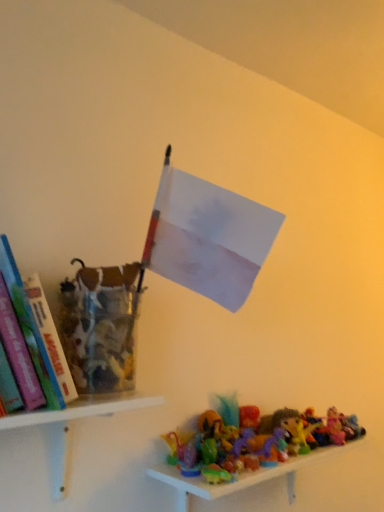
Question: From their relative heights in the image, would you say hardcover book at left is taller or shorter than translucent plastic toys at lower right, which is the 1th shelf from right to left?

Choices:
 (A) short
 (B) tall

Answer: (B)

Question: Is hardcover book at left inside the boundaries of translucent plastic toys at lower right, marked as the 2th shelf in a top-to-bottom arrangement, or outside?

Choices:
 (A) inside
 (B) outside

Answer: (B)

Question: Which is farther from the translucent plastic toys at lower right, positioned as the first shelf in bottom-to-top order?

Choices:
 (A) hardcover book at left
 (B) white plastic shelf at lower left, acting as the 2th shelf starting from the right

Answer: (A)

Question: Which object is positioned closest to the translucent plastic toys at lower right, which is the second shelf in left-to-right order?

Choices:
 (A) white plastic shelf at lower left, acting as the 2th shelf starting from the right
 (B) hardcover book at left

Answer: (A)